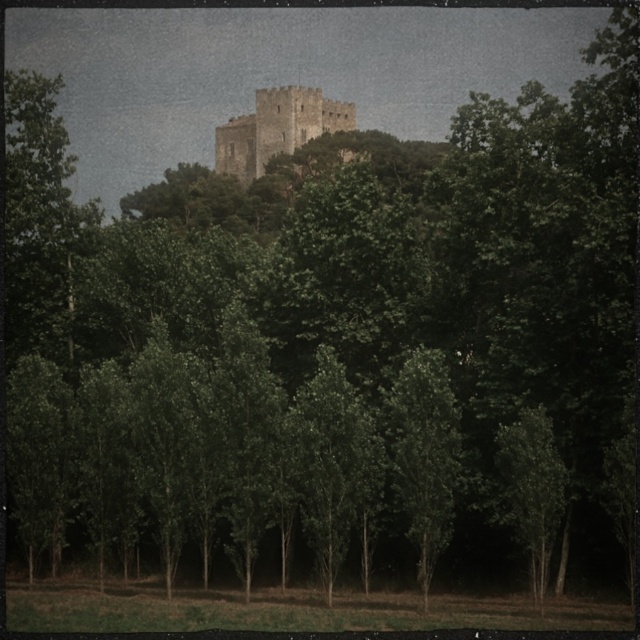
Question: Can you confirm if green leafy tree at lower right is positioned to the left of light beige stone castle at center?

Choices:
 (A) yes
 (B) no

Answer: (B)

Question: Is green leafy tree at lower right to the left of light beige stone castle at center from the viewer's perspective?

Choices:
 (A) no
 (B) yes

Answer: (A)

Question: Which of the following is the closest to the observer?

Choices:
 (A) (317, 134)
 (B) (556, 454)

Answer: (B)

Question: Is green leafy tree at lower right wider than light beige stone castle at center?

Choices:
 (A) yes
 (B) no

Answer: (B)